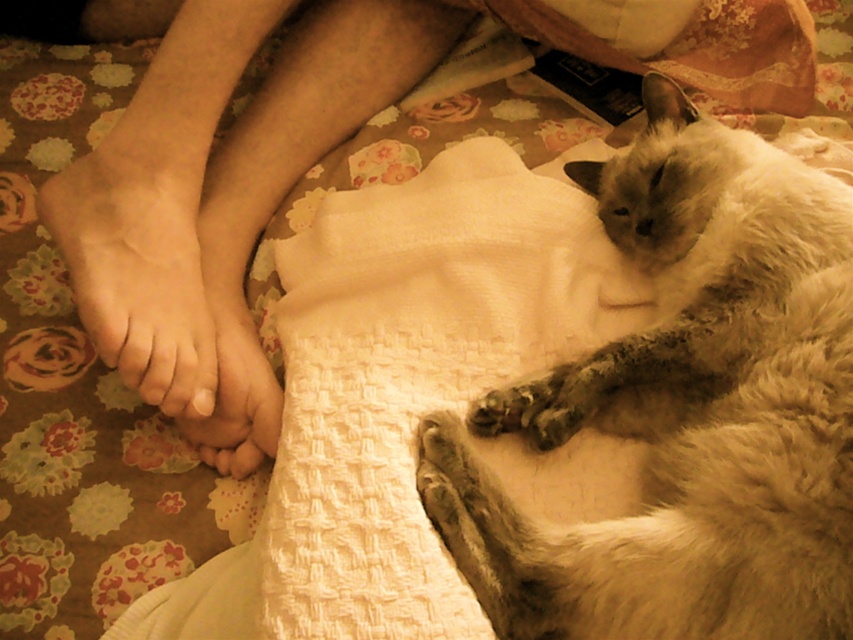
Who is positioned more to the left, silky white cat at upper right or smooth skin foot at lower left?

smooth skin foot at lower left is more to the left.

Is silky white cat at upper right taller than smooth skin foot at lower left?

Indeed, silky white cat at upper right has a greater height compared to smooth skin foot at lower left.

Locate an element on the screen. The image size is (853, 640). silky white cat at upper right is located at coordinates (688, 410).

Is the position of smooth skin foot at lower left less distant than that of smooth skin foot at center?

Yes, smooth skin foot at lower left is closer to the viewer.

Which is behind, point (93, 198) or point (215, 348)?

The point (215, 348) is behind.

Where is `smooth skin foot at lower left`? smooth skin foot at lower left is located at coordinates coord(138,260).

Does silky white cat at upper right appear on the left side of smooth skin foot at center?

Incorrect, silky white cat at upper right is not on the left side of smooth skin foot at center.

Measure the distance between silky white cat at upper right and camera.

silky white cat at upper right is 30.73 inches away from camera.

Locate an element on the screen. The height and width of the screenshot is (640, 853). silky white cat at upper right is located at coordinates (688, 410).